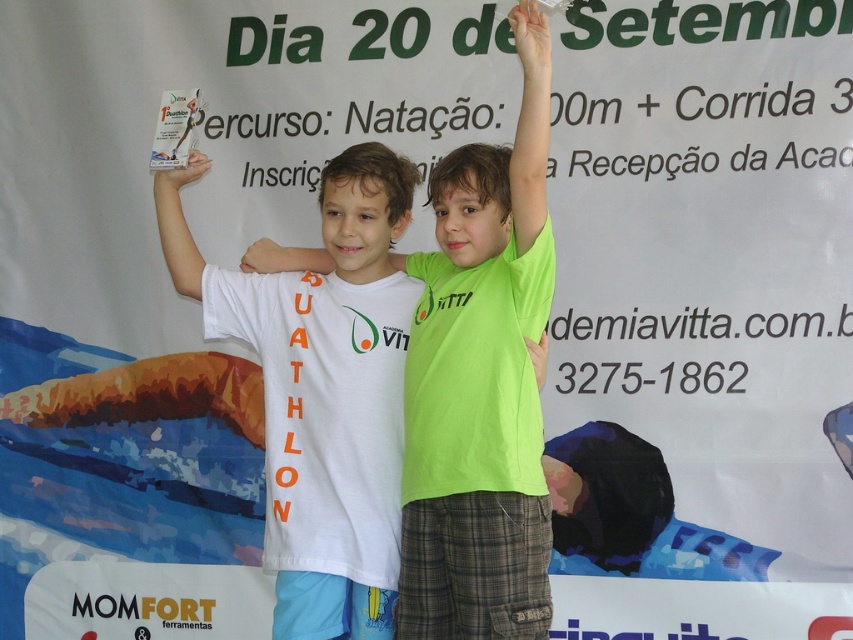
From the picture: You are a photographer who needs to capture a clear shot of both the matte white hand at center and the green matte hand at upper center. Based on their positions, which hand should you focus on first to ensure both are in frame?

The matte white hand at center should be focused on first since it is positioned above the green matte hand at upper center, making it more central in the frame.